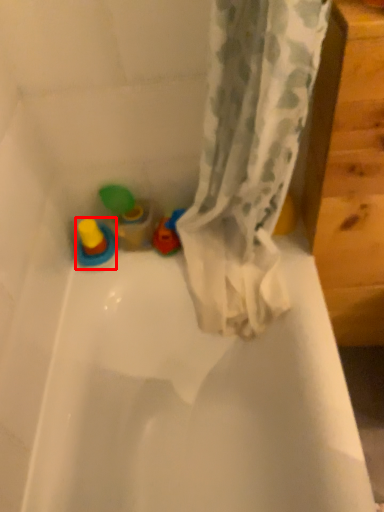
Question: From the image's perspective, considering the relative positions of toy (annotated by the red box) and toy in the image provided, where is toy (annotated by the red box) located with respect to the staircase?

Choices:
 (A) above
 (B) below

Answer: (B)